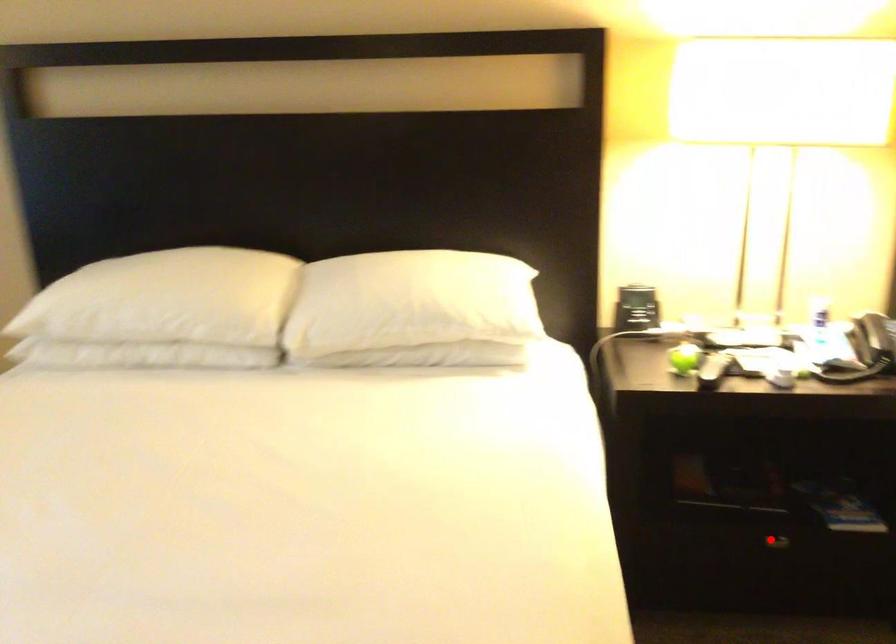
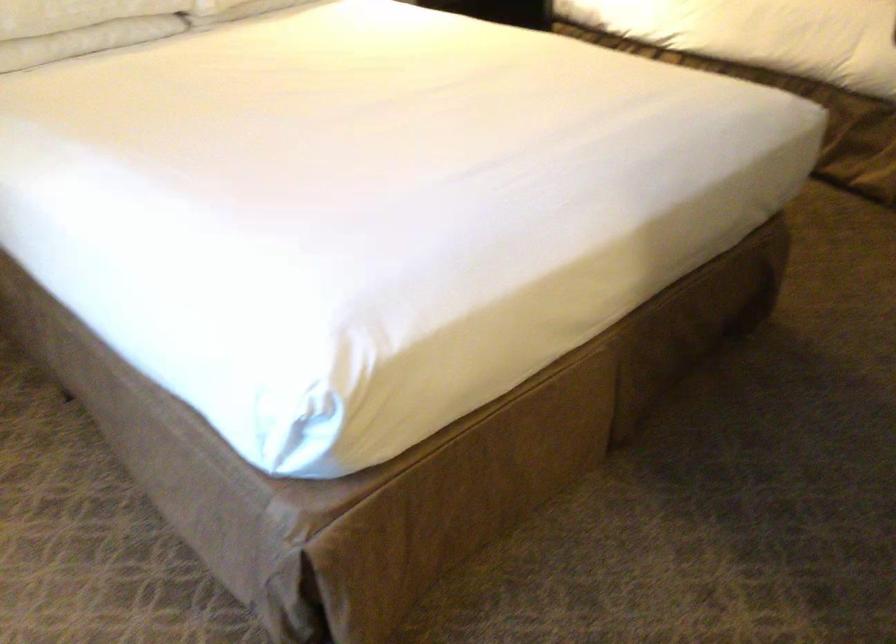
Question: I am providing you with two images of the same scene from different viewpoints. A red point is marked on the first image. Can you still see the location of the red point in image 2?

Choices:
 (A) Yes
 (B) No

Answer: (B)